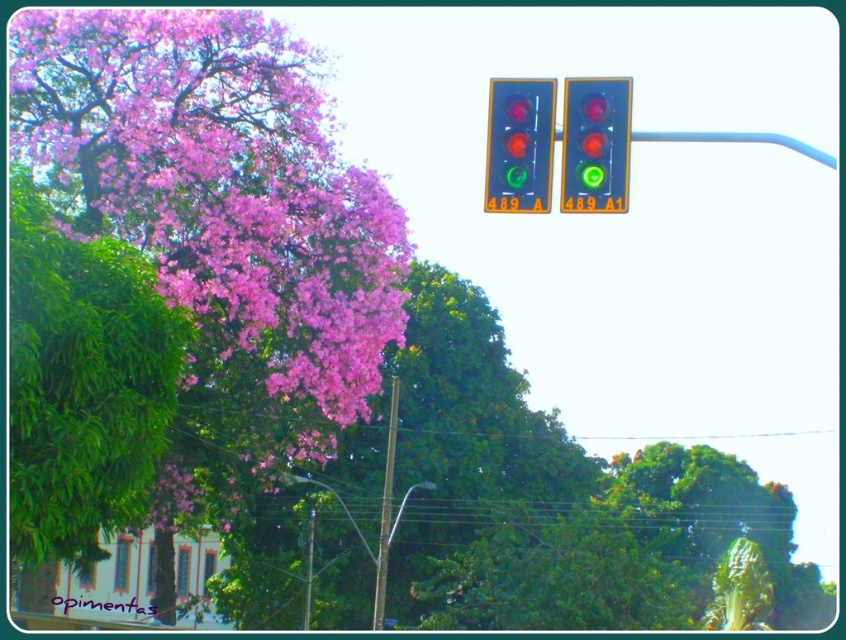
You are a pedestrian standing at the crosswalk and want to cross the street. You notice a pink matte flower at upper left and a metallic pole at center. Which object is closer to your left side?

The pink matte flower at upper left is to the left of the metallic pole at center, so it is closer to your left side.

You are a city planner designing a new pedestrian path that must pass between the pink matte flower at upper left and the metallic pole at center. The path must be at least 8 meters wide to accommodate wheelchair access. Based on the scene, will the existing space between these two objects allow for this requirement?

The distance between the pink matte flower at upper left and the metallic pole at center is 9.09 meters, which exceeds the required 8 meters. Therefore, the existing space is sufficient to accommodate the wheelchair accessible path.

You are a pedestrian standing in the middle of the road looking at the green leafy tree at left and the matte glass traffic light at upper right. Which object is closer to you?

The green leafy tree at left is closer to you because it is further to the viewer than the matte glass traffic light at upper right.